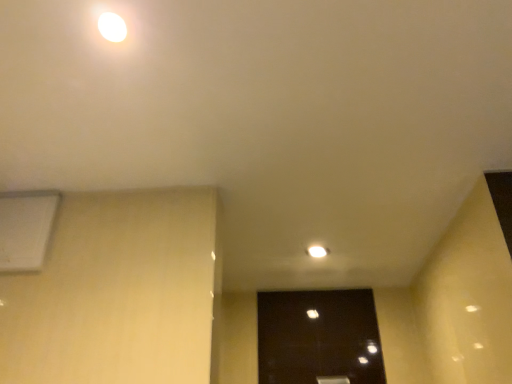
Locate an element on the screen. The height and width of the screenshot is (384, 512). white matte air conditioning at upper left is located at coordinates (26, 229).

Describe the element at coordinates (26, 229) in the screenshot. The image size is (512, 384). I see `white matte air conditioning at upper left` at that location.

What is the approximate height of white glossy light at upper center?

0.39 inches.

Measure the distance between point [97,39] and camera.

The distance of point [97,39] from camera is 84.60 centimeters.

Describe the element at coordinates (114, 28) in the screenshot. This screenshot has height=384, width=512. I see `white glossy light at upper center` at that location.

The height and width of the screenshot is (384, 512). Identify the location of white glossy light at upper center. (114, 28).

Where is `white matte air conditioning at upper left`? The width and height of the screenshot is (512, 384). white matte air conditioning at upper left is located at coordinates (26, 229).

Which object is positioned more to the right, white matte air conditioning at upper left or white glossy light at upper center?

Positioned to the right is white glossy light at upper center.

Does white matte air conditioning at upper left lie behind white glossy light at upper center?

Yes.

Based on the photo, which is farther, (20, 236) or (102, 26)?

The point (20, 236) is behind.

Based on the photo, from the image's perspective, relative to white glossy light at upper center, is white matte air conditioning at upper left above or below?

From the image's perspective, white matte air conditioning at upper left appears below white glossy light at upper center.

From a real-world perspective, between white matte air conditioning at upper left and white glossy light at upper center, who is vertically higher?

From a 3D spatial view, white glossy light at upper center is above.

Can you confirm if white matte air conditioning at upper left is thinner than white glossy light at upper center?

Indeed, white matte air conditioning at upper left has a lesser width compared to white glossy light at upper center.

Considering the sizes of objects white matte air conditioning at upper left and white glossy light at upper center in the image provided, who is taller, white matte air conditioning at upper left or white glossy light at upper center?

white matte air conditioning at upper left is taller.

From the picture: In terms of size, does white matte air conditioning at upper left appear bigger or smaller than white glossy light at upper center?

Considering their sizes, white matte air conditioning at upper left takes up more space than white glossy light at upper center.

Does white matte air conditioning at upper left contain white glossy light at upper center?

No, white glossy light at upper center is located outside of white matte air conditioning at upper left.

Is white matte air conditioning at upper left far from white glossy light at upper center?

white matte air conditioning at upper left is near white glossy light at upper center, not far away.

Could you tell me if white matte air conditioning at upper left is facing white glossy light at upper center?

No.

Can you tell me how much white matte air conditioning at upper left and white glossy light at upper center differ in facing direction?

They differ by 91 degrees in their facing directions.

Where is `air conditioning that appears below the white glossy light at upper center (from a real-world perspective)`? air conditioning that appears below the white glossy light at upper center (from a real-world perspective) is located at coordinates (26, 229).

Considering the relative positions of white glossy light at upper center and white matte air conditioning at upper left in the image provided, is white glossy light at upper center to the right of white matte air conditioning at upper left from the viewer's perspective?

Yes.

Which object is further away from the camera, white glossy light at upper center or white matte air conditioning at upper left?

white matte air conditioning at upper left is further away from the camera.

Does point (95, 18) appear closer or farther from the camera than point (42, 254)?

Point (95, 18) is closer to the camera than point (42, 254).

From the image's perspective, does white glossy light at upper center appear lower than white matte air conditioning at upper left?

Actually, white glossy light at upper center appears above white matte air conditioning at upper left in the image.

From a real-world perspective, does white glossy light at upper center sit lower than white matte air conditioning at upper left?

Actually, white glossy light at upper center is physically above white matte air conditioning at upper left in the real world.

Based on the photo, is white glossy light at upper center wider than white matte air conditioning at upper left?

Yes, white glossy light at upper center is wider than white matte air conditioning at upper left.

Considering the relative sizes of white glossy light at upper center and white matte air conditioning at upper left in the image provided, is white glossy light at upper center shorter than white matte air conditioning at upper left?

Yes.

Is white glossy light at upper center bigger than white matte air conditioning at upper left?

Actually, white glossy light at upper center might be smaller than white matte air conditioning at upper left.

Is white glossy light at upper center inside the boundaries of white matte air conditioning at upper left, or outside?

white glossy light at upper center is not inside white matte air conditioning at upper left, it's outside.

Is white glossy light at upper center in contact with white matte air conditioning at upper left?

No, white glossy light at upper center is not with white matte air conditioning at upper left.

Is white glossy light at upper center looking in the opposite direction of white matte air conditioning at upper left?

No, white glossy light at upper center is not facing the opposite direction of white matte air conditioning at upper left.

What's the angular difference between white glossy light at upper center and white matte air conditioning at upper left's facing directions?

There is a 91-degree angle between the facing directions of white glossy light at upper center and white matte air conditioning at upper left.

Find the location of `air conditioning on the left side of white glossy light at upper center`. air conditioning on the left side of white glossy light at upper center is located at coordinates (26, 229).

At what (x,y) coordinates should I click in order to perform the action: click on light lying on the right of white matte air conditioning at upper left. Please return your answer as a coordinate pair (x, y). The width and height of the screenshot is (512, 384). Looking at the image, I should click on (114, 28).

You are a GUI agent. You are given a task and a screenshot of the screen. Output one action in this format:
    pyautogui.click(x=<x>, y=<y>)
    Task: Click on the light that appears above the white matte air conditioning at upper left (from the image's perspective)
    This screenshot has height=384, width=512.
    Given the screenshot: What is the action you would take?
    pyautogui.click(x=114, y=28)